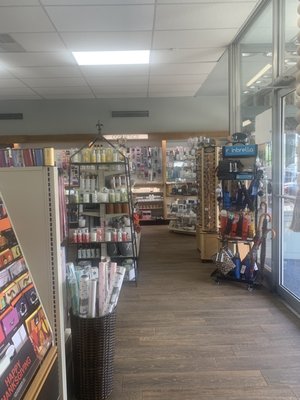
Identify the location of light. The height and width of the screenshot is (400, 300). (125, 54).